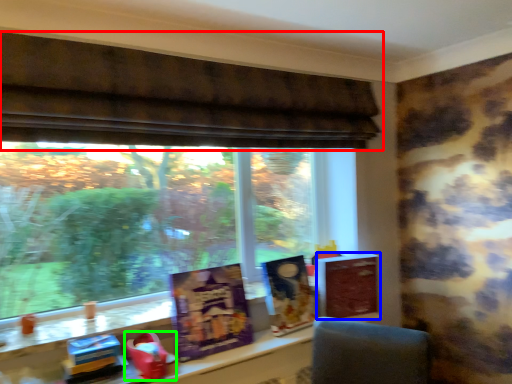
Question: Estimate the real-world distances between objects in this image. Which object is closer to window (highlighted by a red box), paperback book (highlighted by a blue box) or toy (highlighted by a green box)?

Choices:
 (A) paperback book
 (B) toy

Answer: (A)